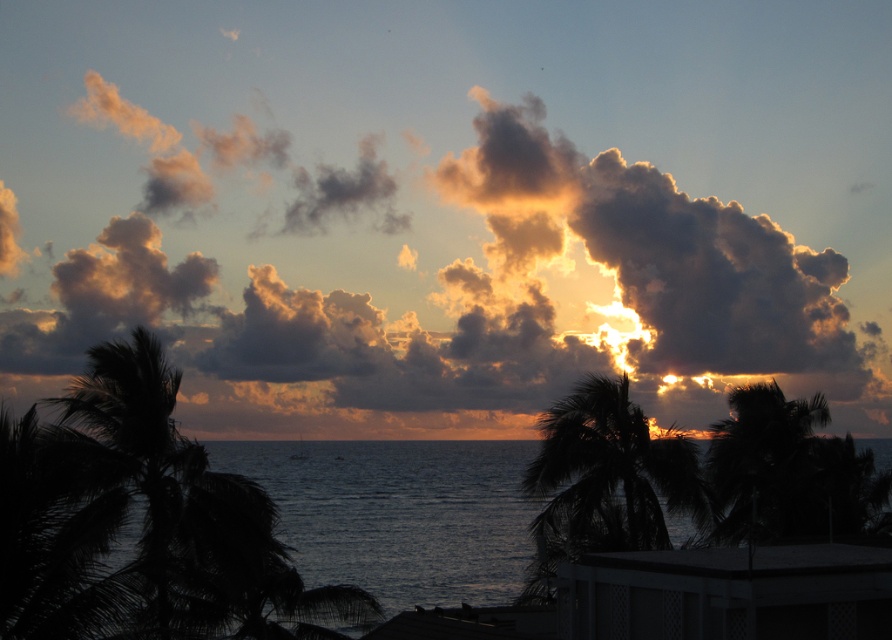
You are standing on the beach and want to take a photo of the sunset. You have a camera that can only capture objects within a 2 meter width. The white lattice balcony at lower right and the dark green leafy palm tree at right are both in your view. Which object can fit entirely within your camera frame?

The white lattice balcony at lower right can fit entirely within the camera frame because its width is less than the dark green leafy palm tree at right, and the camera can capture up to 2 meters. Since the balcony is narrower, it will fit within the 2 meter width limit.